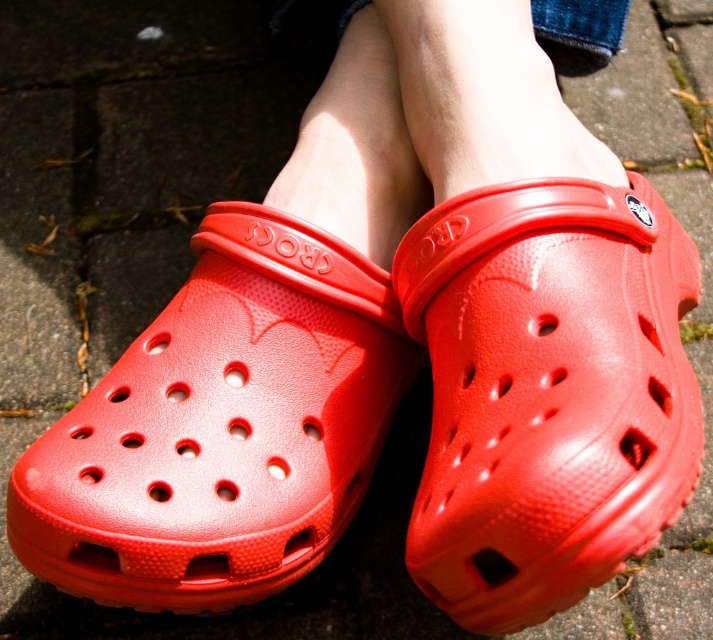
You are standing at the origin point of the coordinate system in the image. The image shows a satin red clog at center. Where is the satin red clog located in terms of coordinates?

The satin red clog at center is located at coordinates point (x=548, y=392).

You are standing in front of the Crocs shoes in the image. There is a point marked at coordinate (548, 392). Which object does this point correspond to?

The point at coordinate (548, 392) corresponds to the satin red clog at center.

You are standing in front of two clogs at the center of the image. Which one is closer to you, the satin red clog at center or the matte plastic clog at center?

The satin red clog at center is closer to you because it is in front of the matte plastic clog at center.